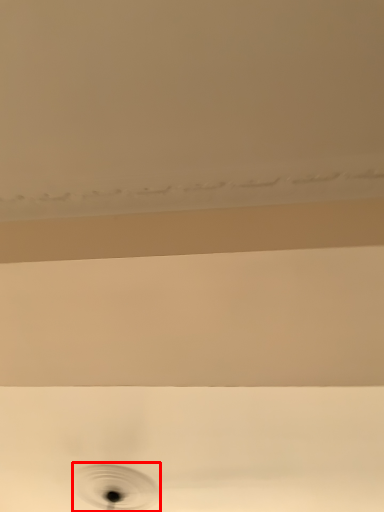
Question: From the image's perspective, where is hole (annotated by the red box) located in relation to plumbing fixture in the image?

Choices:
 (A) below
 (B) above

Answer: (A)